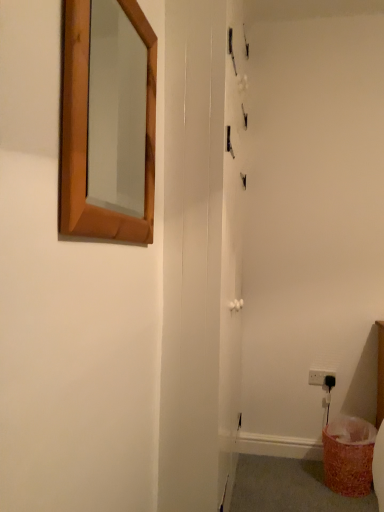
Question: In terms of width, does white plastic electric outlet at lower right look wider or thinner when compared to orange textured laundry basket at lower right?

Choices:
 (A) wide
 (B) thin

Answer: (B)

Question: Based on their positions, is white plastic electric outlet at lower right located to the left or right of orange textured laundry basket at lower right?

Choices:
 (A) right
 (B) left

Answer: (B)

Question: Estimate the real-world distances between objects in this image. Which object is farther from the wooden-framed mirror at upper left?

Choices:
 (A) white glossy screen door at center
 (B) orange textured laundry basket at lower right
 (C) white plastic electric outlet at lower right

Answer: (C)

Question: Estimate the real-world distances between objects in this image. Which object is farther from the wooden-framed mirror at upper left?

Choices:
 (A) white plastic electric outlet at lower right
 (B) orange textured laundry basket at lower right
 (C) white glossy screen door at center

Answer: (A)